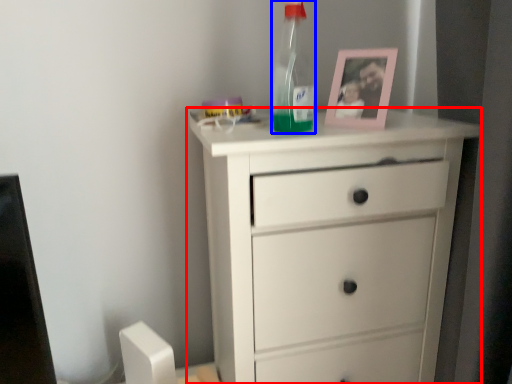
Question: Which object is closer to the camera taking this photo, chest of drawers (highlighted by a red box) or bottle (highlighted by a blue box)?

Choices:
 (A) chest of drawers
 (B) bottle

Answer: (A)